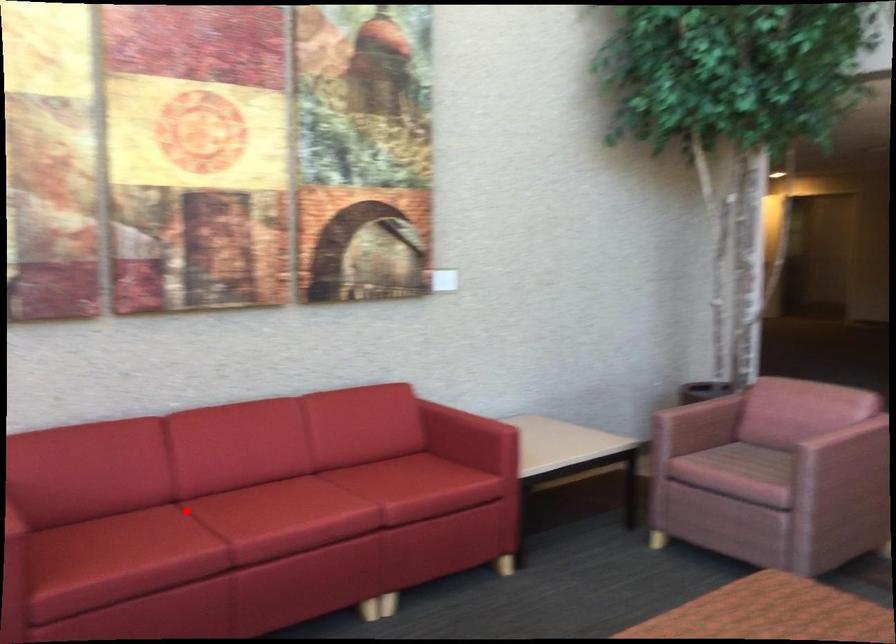
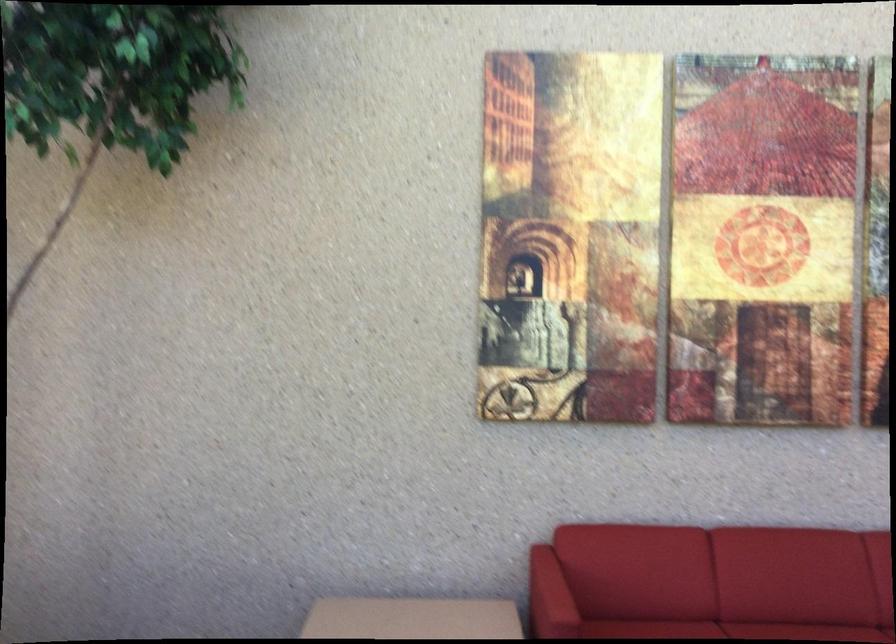
Find the pixel in the second image that matches the highlighted location in the first image.

(727, 630)